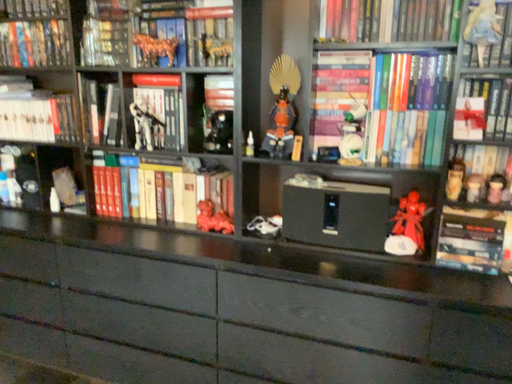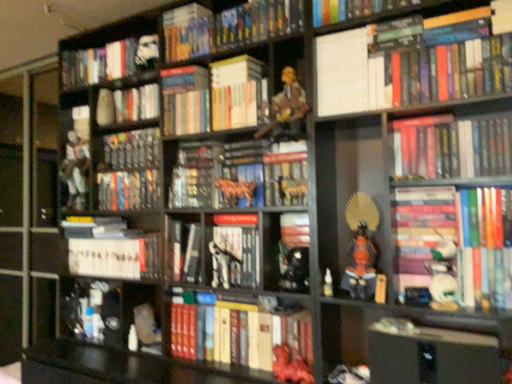
Question: Which way did the camera rotate in the video?

Choices:
 (A) rotated right
 (B) rotated left

Answer: (B)